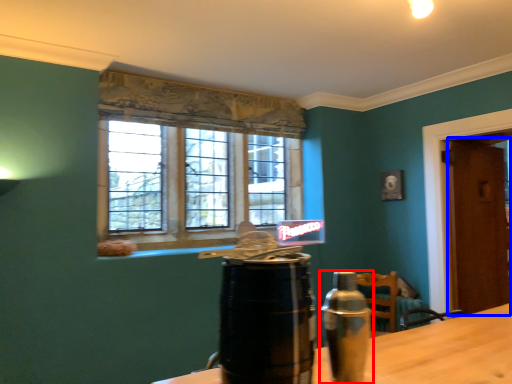
Question: Which object is further to the camera taking this photo, bottle (highlighted by a red box) or door (highlighted by a blue box)?

Choices:
 (A) bottle
 (B) door

Answer: (B)